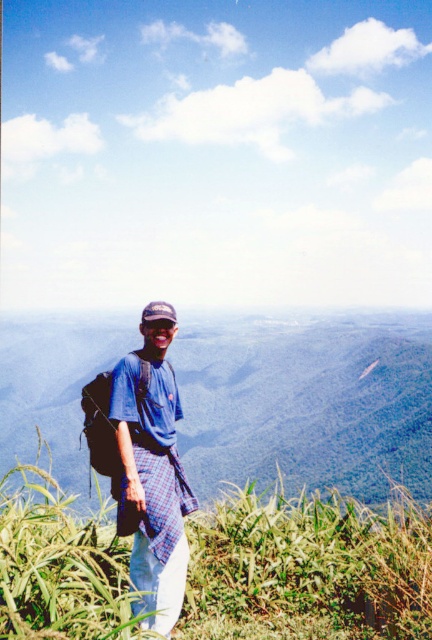
Question: Is green leafy mountain at center further to camera compared to green grass at lower left?

Choices:
 (A) yes
 (B) no

Answer: (A)

Question: Which of the following is the closest to the observer?

Choices:
 (A) green grass at lower left
 (B) green leafy mountain at center
 (C) blue plaid shirt at center

Answer: (A)

Question: In this image, where is green leafy mountain at center located relative to blue plaid shirt at center?

Choices:
 (A) below
 (B) above

Answer: (A)

Question: Which object is closer to the camera taking this photo?

Choices:
 (A) blue plaid shirt at center
 (B) green grass at lower left

Answer: (B)

Question: In this image, where is green leafy mountain at center located relative to blue plaid shirt at center?

Choices:
 (A) below
 (B) above

Answer: (A)

Question: Among these points, which one is farthest from the camera?

Choices:
 (A) (152, 436)
 (B) (95, 628)
 (C) (22, 326)

Answer: (C)